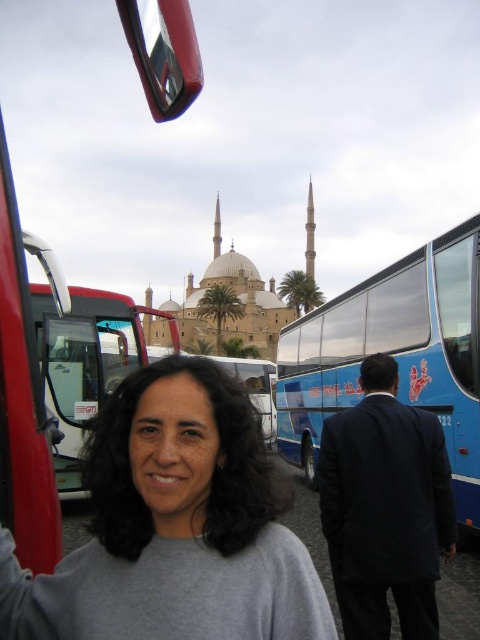
Does blue glossy bus at right appear under metallic silver bus at left?

Yes, blue glossy bus at right is below metallic silver bus at left.

Where is `blue glossy bus at right`? Image resolution: width=480 pixels, height=640 pixels. blue glossy bus at right is located at coordinates coord(394,355).

Can you confirm if gray matte sweater at center is shorter than blue glossy bus at right?

Yes, gray matte sweater at center is shorter than blue glossy bus at right.

Between gray matte sweater at center and blue glossy bus at right, which one has less height?

gray matte sweater at center

Measure the distance between point (90, 632) and camera.

Point (90, 632) and camera are 187.17 feet apart from each other.

Where is `gray matte sweater at center`? gray matte sweater at center is located at coordinates (173, 525).

Is point (123, 547) farther from viewer compared to point (171, 330)?

No, it is not.

Based on the photo, measure the distance between gray matte sweater at center and metallic silver bus at left.

26.26 meters

Is point (12, 605) farther from viewer compared to point (66, 426)?

No, (12, 605) is in front of (66, 426).

Locate an element on the screen. The height and width of the screenshot is (640, 480). gray matte sweater at center is located at coordinates (173, 525).